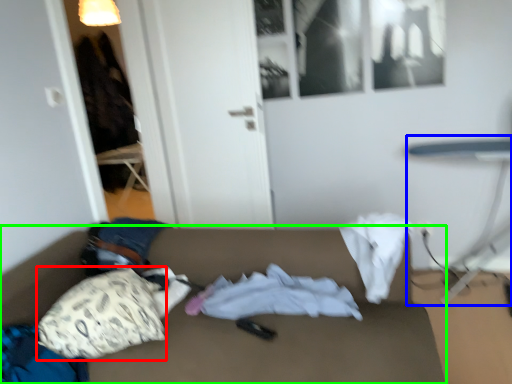
Question: Based on their relative distances, which object is nearer to throw pillow (highlighted by a red box)? Choose from table (highlighted by a blue box) and studio couch (highlighted by a green box).

Choices:
 (A) table
 (B) studio couch

Answer: (B)